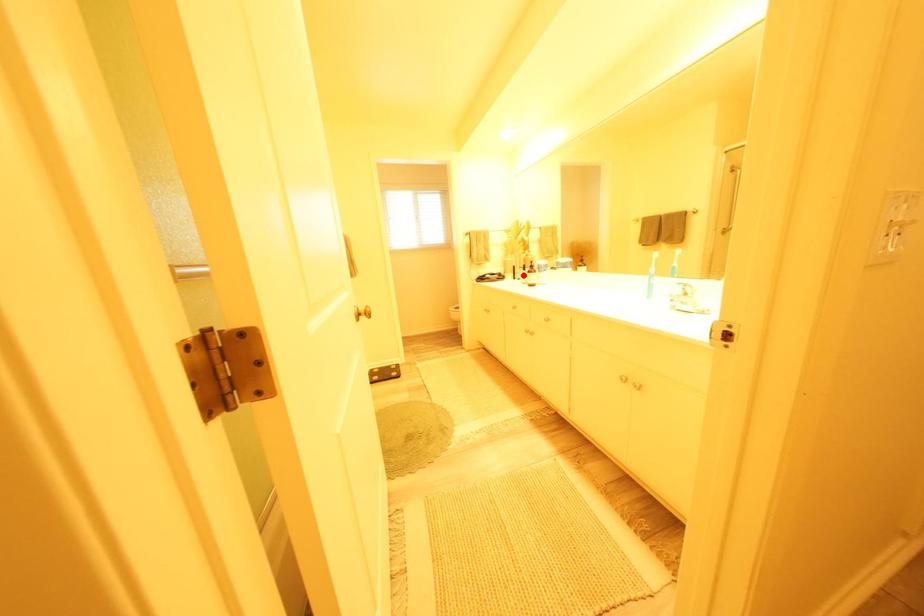
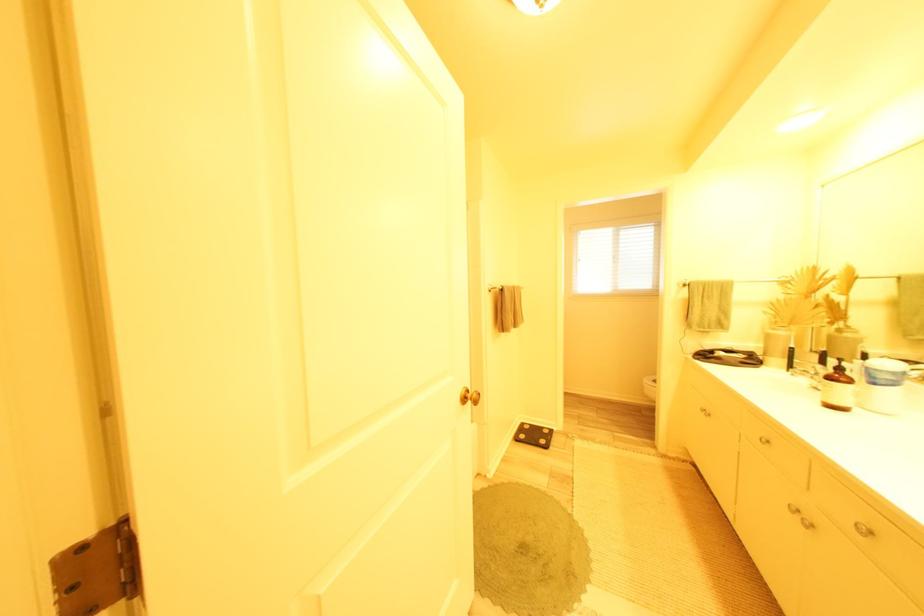
Question: I am providing you with two images of the same scene from different viewpoints. Given a red point in image1, look at the same physical point in image2. Is it:

Choices:
 (A) Closer to the viewpoint
 (B) Farther from the viewpoint

Answer: (B)